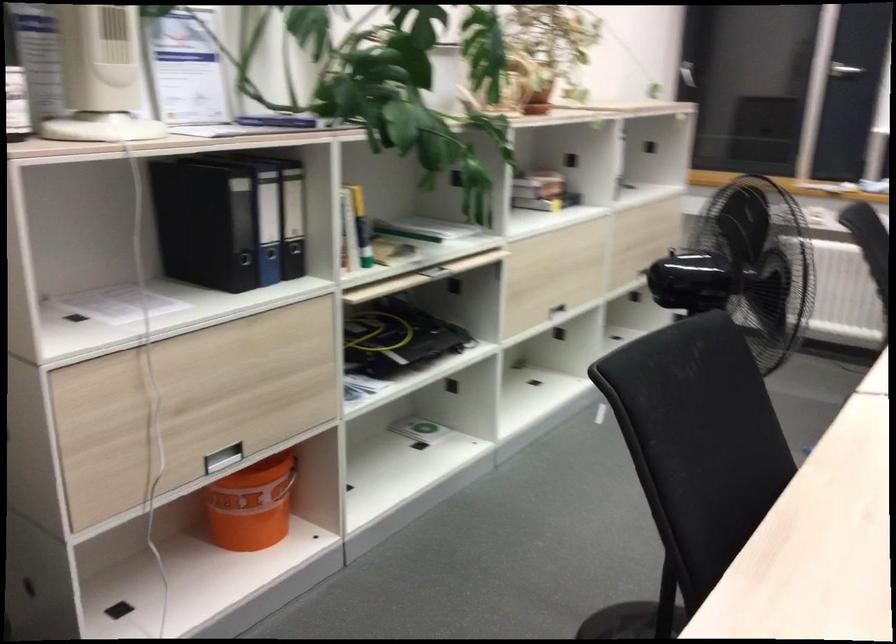
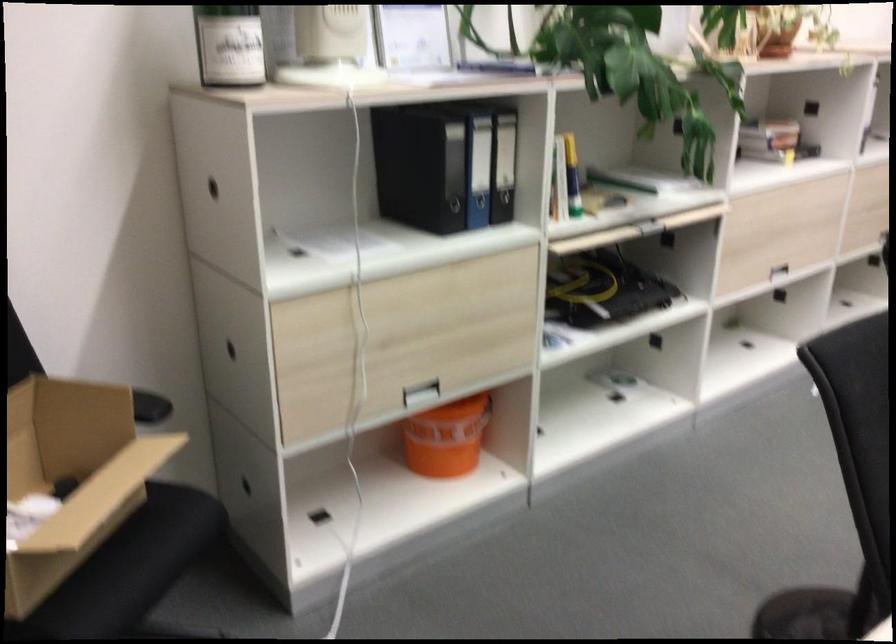
Locate, in the second image, the point that corresponds to the point at 254,503 in the first image.

(446, 438)